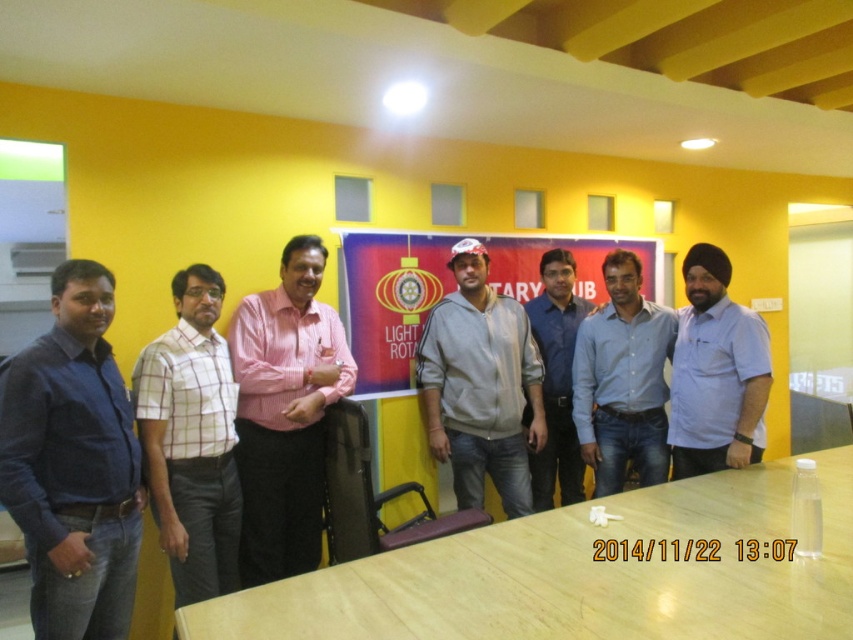
You are a photographer trying to capture a detailed shot of two specific points in the image. The first point is at coordinates point (152, 499) and the second is at point (549, 371). Given that you want to focus on the point that is nearer to the camera, which coordinate should you prioritize?

You should prioritize focusing on point (152, 499) because it is closer to the camera than point (549, 371).

You are attending the LIGHT ROTARY CLUB event and notice two people wearing gray fleece jacket at center and blue denim jeans at center. Which one is positioned to the left?

The gray fleece jacket at center is to the left of the blue denim jeans at center.

You are organizing a photo shoot and need to ensure that the blue shirt at left and the matte plastic banner at center are both visible in the frame. Given their sizes, which object might require you to adjust the camera angle to ensure it doesn not get cropped?

The blue shirt at left has a lesser width compared to the matte plastic banner at center, so the blue shirt at left might require adjusting the camera angle to ensure it doesn not get cropped.